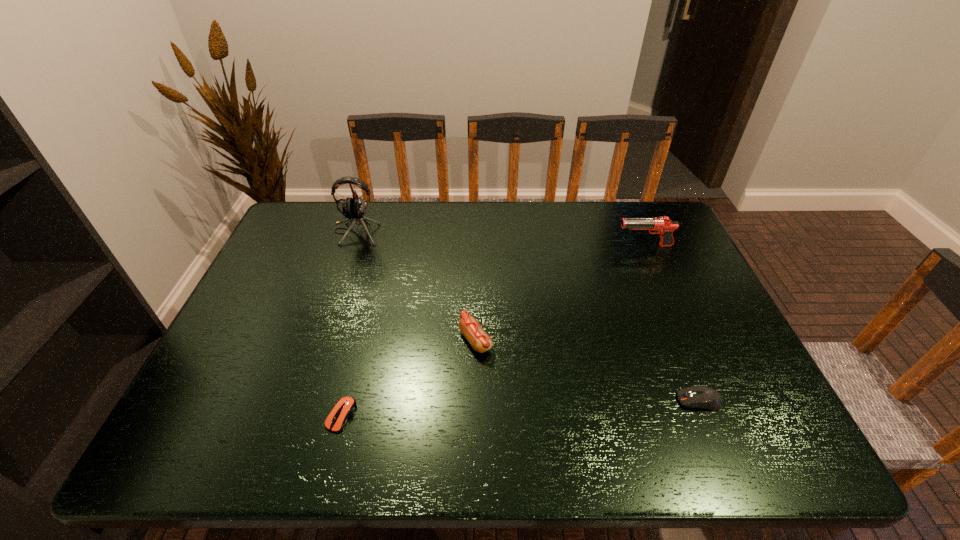
This screenshot has height=540, width=960. What are the coordinates of `free space located 0.230m at the aiming end of the second tallest object` in the screenshot? It's located at (543, 246).

You are a GUI agent. You are given a task and a screenshot of the screen. Output one action in this format:
    pyautogui.click(x=<x>, y=<y>)
    Task: Click on the vacant space located at the aiming end of the second tallest object
    The height and width of the screenshot is (540, 960).
    Given the screenshot: What is the action you would take?
    pyautogui.click(x=578, y=246)

Find the location of a particular element. This screenshot has height=540, width=960. free space located on the left of the sausage is located at coordinates (422, 340).

Locate an element on the screen. free space located on the button of the taller computer mouse is located at coordinates (499, 400).

What are the coordinates of `vacant area situated on the button of the taller computer mouse` in the screenshot? It's located at (548, 400).

I want to click on vacant area situated 0.120m on the button of the taller computer mouse, so click(624, 400).

In order to click on free spot located 0.110m on the left of the shortest object in this screenshot , I will do `click(277, 415)`.

Image resolution: width=960 pixels, height=540 pixels. Identify the location of earphone at the far edge. (354, 209).

Identify the location of gun present at the far edge. (663, 226).

Find the location of a particular element. Image resolution: width=960 pixels, height=540 pixels. object present at the near edge is located at coordinates (345, 407).